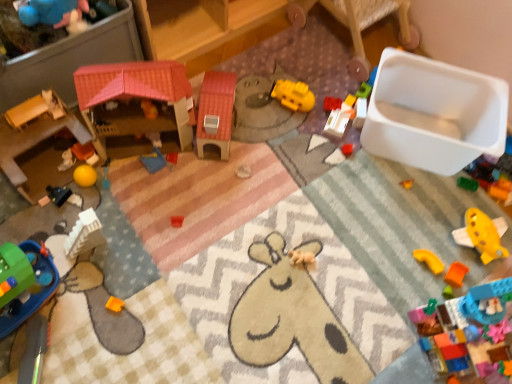
Where is `free space that is in between yellow matte plastic toy at center, which is the 8th toy from left to right, and translucent blue plastic blocks at lower right, the third toy viewed from the right`? Image resolution: width=512 pixels, height=384 pixels. free space that is in between yellow matte plastic toy at center, which is the 8th toy from left to right, and translucent blue plastic blocks at lower right, the third toy viewed from the right is located at coordinates (364, 214).